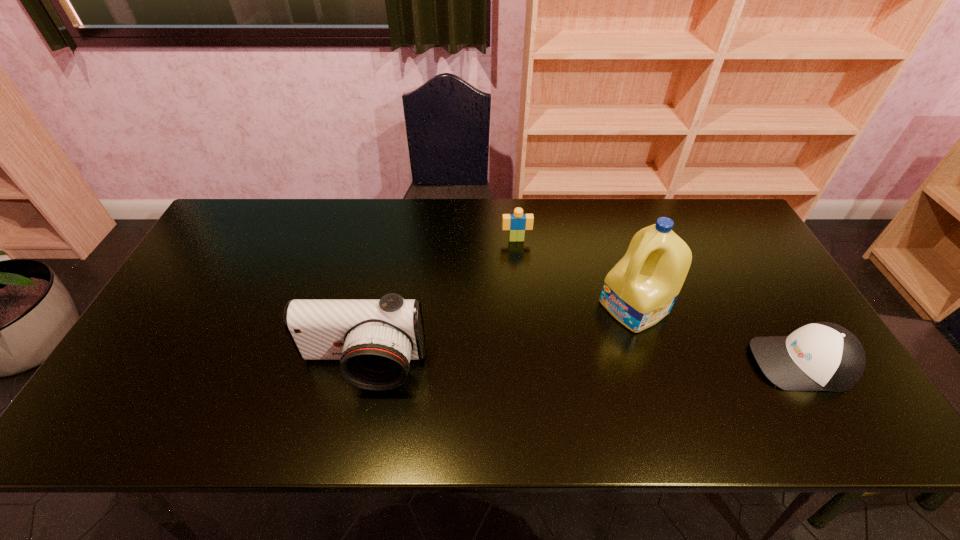
At what (x,y) coordinates should I click in order to perform the action: click on object that is positioned at the near right corner. Please return your answer as a coordinate pair (x, y). The width and height of the screenshot is (960, 540). Looking at the image, I should click on (821, 356).

Locate an element on the screen. This screenshot has height=540, width=960. free space at the far edge of the desktop is located at coordinates (577, 216).

I want to click on vacant space at the near edge of the desktop, so click(550, 366).

This screenshot has width=960, height=540. What are the coordinates of `free space at the left edge of the desktop` in the screenshot? It's located at (162, 315).

This screenshot has width=960, height=540. Find the location of `blank space at the right edge of the desktop`. blank space at the right edge of the desktop is located at coordinates click(x=739, y=285).

At what (x,y) coordinates should I click in order to perform the action: click on empty space that is in between the rightmost object and the second tallest object. Please return your answer as a coordinate pair (x, y). This screenshot has width=960, height=540. Looking at the image, I should click on (582, 364).

You are a GUI agent. You are given a task and a screenshot of the screen. Output one action in this format:
    pyautogui.click(x=<x>, y=<y>)
    Task: Click on the free spot between the leftmost object and the cap
    This screenshot has width=960, height=540.
    Given the screenshot: What is the action you would take?
    pyautogui.click(x=582, y=364)

The image size is (960, 540). Find the location of `vacant space that is in between the third object from right to left and the second farthest object`. vacant space that is in between the third object from right to left and the second farthest object is located at coordinates (575, 273).

In order to click on free area in between the second object from right to left and the leftmost object in this screenshot , I will do click(498, 337).

Where is `blank region between the farthest object and the second tallest object`? Image resolution: width=960 pixels, height=540 pixels. blank region between the farthest object and the second tallest object is located at coordinates (440, 303).